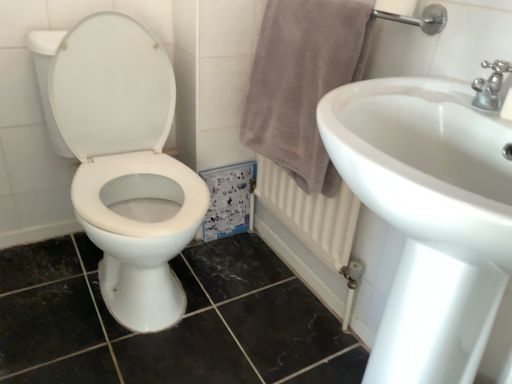
Image resolution: width=512 pixels, height=384 pixels. What do you see at coordinates (429, 216) in the screenshot?
I see `white glossy sink at upper right` at bounding box center [429, 216].

This screenshot has width=512, height=384. What are the coordinates of `light gray plush towel at right` in the screenshot? It's located at coord(303,82).

Is silver metallic faucet at upper right completely or partially outside of white glossy toilet at left?

Indeed, silver metallic faucet at upper right is completely outside white glossy toilet at left.

Considering the positions of objects silver metallic faucet at upper right and white glossy toilet at left in the image provided, who is more to the right, silver metallic faucet at upper right or white glossy toilet at left?

silver metallic faucet at upper right is more to the right.

In the scene shown: How much distance is there between silver metallic faucet at upper right and white glossy toilet at left?

silver metallic faucet at upper right is 37.59 inches from white glossy toilet at left.

Which of these two, silver metallic faucet at upper right or white glossy toilet at left, is bigger?

white glossy toilet at left is bigger.

Is white glossy sink at upper right positioned far away from white glossy toilet at left?

white glossy sink at upper right is near white glossy toilet at left, not far away.

Relative to white glossy toilet at left, is white glossy sink at upper right in front or behind?

Clearly, white glossy sink at upper right is in front of white glossy toilet at left.

From the picture: Which of these two, white glossy sink at upper right or white glossy toilet at left, stands shorter?

white glossy sink at upper right.

From a real-world perspective, which object rests below the other?

white glossy sink at upper right, from a real-world perspective.

From the picture: How different are the orientations of white glossy toilet at left and white glossy sink at upper right in degrees?

90.7 degrees separate the facing orientations of white glossy toilet at left and white glossy sink at upper right.

Looking at this image, from a real-world perspective, is white glossy toilet at left on white glossy sink at upper right?

Yes, from a real-world perspective, white glossy toilet at left is above white glossy sink at upper right.

Is white glossy toilet at left smaller than white glossy sink at upper right?

Actually, white glossy toilet at left might be larger than white glossy sink at upper right.

Does white glossy toilet at left have a greater height compared to white glossy sink at upper right?

Yes, white glossy toilet at left is taller than white glossy sink at upper right.

Is point (431, 284) more distant than point (327, 58)?

That is False.

Based on the photo, which of these two, white glossy sink at upper right or light gray plush towel at right, stands shorter?

With less height is light gray plush towel at right.

Which object is positioned more to the right, white glossy sink at upper right or light gray plush towel at right?

white glossy sink at upper right is more to the right.

Is white glossy sink at upper right not within light gray plush towel at right?

Yes, white glossy sink at upper right is outside of light gray plush towel at right.

In the scene shown: Which is more distant, (482,87) or (421,290)?

The point (482,87) is farther from the camera.

Could white glossy sink at upper right be considered to be inside silver metallic faucet at upper right?

No, white glossy sink at upper right is not a part of silver metallic faucet at upper right.

From the picture: From a real-world perspective, who is located lower, silver metallic faucet at upper right or white glossy sink at upper right?

white glossy sink at upper right.

How different are the orientations of silver metallic faucet at upper right and white glossy sink at upper right in degrees?

The angular difference between silver metallic faucet at upper right and white glossy sink at upper right is 1.06 degrees.

Consider the image. Looking at the image, does white glossy toilet at left seem bigger or smaller compared to light gray plush towel at right?

Considering their sizes, white glossy toilet at left takes up more space than light gray plush towel at right.

From a real-world perspective, is white glossy toilet at left below light gray plush towel at right?

Yes, from a real-world perspective, white glossy toilet at left is under light gray plush towel at right.

Where is `bath towel behind the white glossy toilet at left`? The height and width of the screenshot is (384, 512). bath towel behind the white glossy toilet at left is located at coordinates (303, 82).

Is white glossy toilet at left thinner than light gray plush towel at right?

Incorrect, the width of white glossy toilet at left is not less than that of light gray plush towel at right.

Which of these two, light gray plush towel at right or white glossy toilet at left, is bigger?

Bigger between the two is white glossy toilet at left.

Is point (312, 168) more distant than point (101, 79)?

No, it is not.

Are light gray plush towel at right and white glossy toilet at left making contact?

No, light gray plush towel at right is not touching white glossy toilet at left.

From a real-world perspective, does light gray plush towel at right sit lower than white glossy toilet at left?

No, from a real-world perspective, light gray plush towel at right is not under white glossy toilet at left.

Identify the location of toilet that is below the silver metallic faucet at upper right (from the image's perspective). This screenshot has height=384, width=512. (126, 164).

You are a GUI agent. You are given a task and a screenshot of the screen. Output one action in this format:
    pyautogui.click(x=<x>, y=<y>)
    Task: Click on the toilet above the white glossy sink at upper right (from a real-world perspective)
    The image size is (512, 384).
    Given the screenshot: What is the action you would take?
    pyautogui.click(x=126, y=164)

When comparing their distances from silver metallic faucet at upper right, does light gray plush towel at right or white glossy toilet at left seem further?

white glossy toilet at left is further to silver metallic faucet at upper right.

From the image, which object appears to be nearer to light gray plush towel at right, silver metallic faucet at upper right or white glossy toilet at left?

white glossy toilet at left is closer to light gray plush towel at right.

Looking at this image, which object lies nearer to the anchor point light gray plush towel at right, silver metallic faucet at upper right or white glossy sink at upper right?

The object closer to light gray plush towel at right is white glossy sink at upper right.

Which object lies nearer to the anchor point silver metallic faucet at upper right, white glossy sink at upper right or white glossy toilet at left?

Based on the image, white glossy sink at upper right appears to be nearer to silver metallic faucet at upper right.

When comparing their distances from light gray plush towel at right, does white glossy sink at upper right or silver metallic faucet at upper right seem further?

The object further to light gray plush towel at right is silver metallic faucet at upper right.

Which object lies further to the anchor point white glossy sink at upper right, light gray plush towel at right or silver metallic faucet at upper right?

The object further to white glossy sink at upper right is light gray plush towel at right.

Which object lies further to the anchor point light gray plush towel at right, white glossy toilet at left or silver metallic faucet at upper right?

Based on the image, silver metallic faucet at upper right appears to be further to light gray plush towel at right.

Looking at the image, which one is located closer to silver metallic faucet at upper right, white glossy sink at upper right or light gray plush towel at right?

white glossy sink at upper right is closer to silver metallic faucet at upper right.

What are the coordinates of `bath towel between white glossy toilet at left and white glossy sink at upper right in the horizontal direction` in the screenshot? It's located at (303, 82).

The height and width of the screenshot is (384, 512). Identify the location of sink between white glossy toilet at left and silver metallic faucet at upper right from left to right. (429, 216).

Identify the location of tap between white glossy sink at upper right and light gray plush towel at right in the front-back direction. Image resolution: width=512 pixels, height=384 pixels. (490, 86).

The width and height of the screenshot is (512, 384). Find the location of `bath towel between white glossy toilet at left and silver metallic faucet at upper right from left to right`. bath towel between white glossy toilet at left and silver metallic faucet at upper right from left to right is located at coordinates (303, 82).